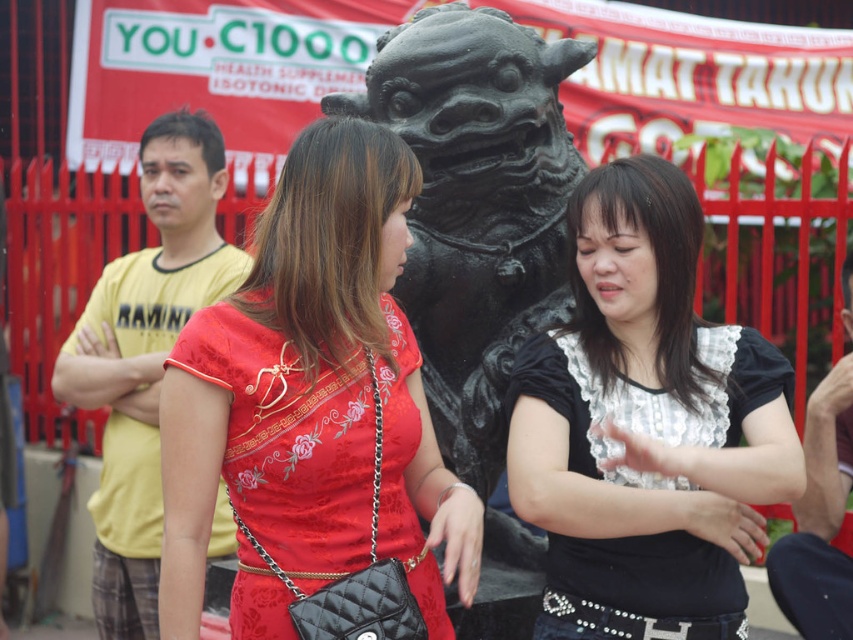
You are a photographer trying to capture the woman in the scene. Which item should you focus on first if you want to photograph the matte red dress at center and the black lace blouse at center from top to bottom?

The matte red dress at center is located above the black lace blouse at center, so you should focus on the matte red dress at center first when photographing from top to bottom.

You are a photographer trying to capture the matte red dress at center in the image. If your camera is focused at point coordinates of 0.634, 0.367, will the dress be in focus?

Yes, the matte red dress at center is exactly at point coordinates of (312, 404), so it will be in focus.